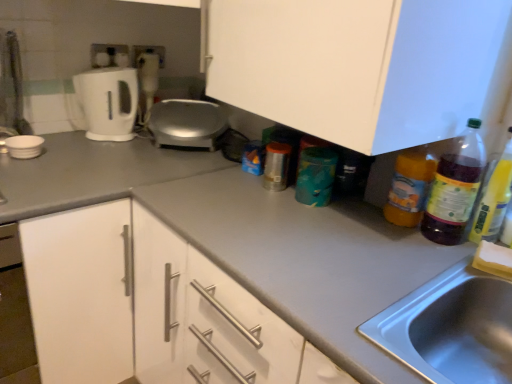
Identify the location of free space in front of translucent plastic bottle at right, which appears as the 2th bottle when viewed from the right. Image resolution: width=512 pixels, height=384 pixels. (402, 248).